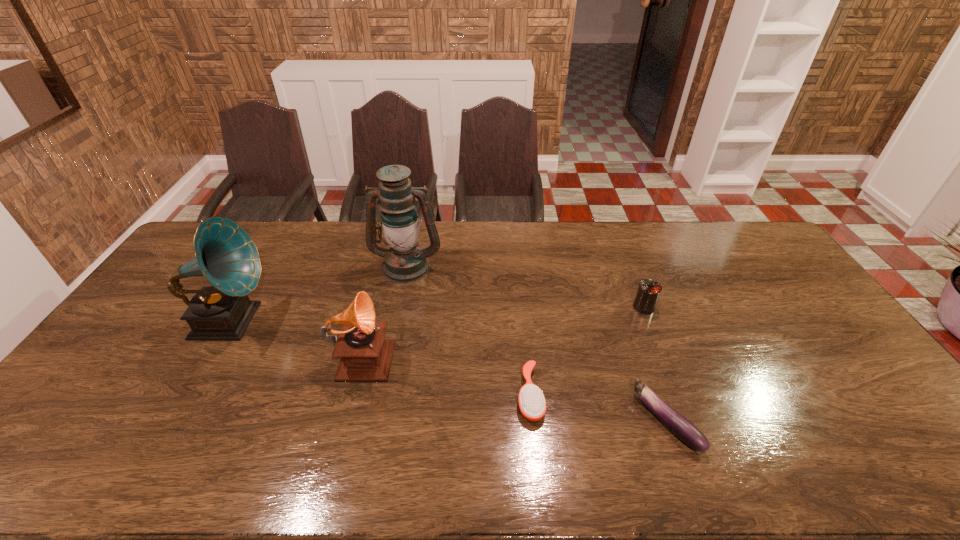
Locate an element on the screen. object that stands as the fifth closest to the farthest object is located at coordinates (681, 427).

I want to click on the second closest object to the oil lamp, so click(x=225, y=254).

The width and height of the screenshot is (960, 540). Identify the location of free space that satisfies the following two spatial constraints: 1. on the horn of the eggplant; 2. on the right side of the third tallest object. (346, 421).

Find the location of `free space that satisfies the following two spatial constraints: 1. on the back side of the hairbrush; 2. on the horn of the right phonograph record`. free space that satisfies the following two spatial constraints: 1. on the back side of the hairbrush; 2. on the horn of the right phonograph record is located at coordinates (526, 353).

You are a GUI agent. You are given a task and a screenshot of the screen. Output one action in this format:
    pyautogui.click(x=<x>, y=<y>)
    Task: Click on the vacant area in the image that satisfies the following two spatial constraints: 1. from the horn of the eggplant; 2. on the left side of the leftmost object
    
    Given the screenshot: What is the action you would take?
    (172, 421)

The height and width of the screenshot is (540, 960). What are the coordinates of `vacant region that satisfies the following two spatial constraints: 1. on the front side of the oil lamp; 2. on the right side of the eggplant` in the screenshot? It's located at (376, 421).

At what (x,y) coordinates should I click in order to perform the action: click on free space that satisfies the following two spatial constraints: 1. on the horn of the right phonograph record; 2. on the left side of the fourth object from left to right. Please return your answer as a coordinate pair (x, y). This screenshot has width=960, height=540. Looking at the image, I should click on (352, 395).

I want to click on free spot that satisfies the following two spatial constraints: 1. on the front side of the oil lamp; 2. on the left side of the eggplant, so click(x=376, y=421).

You are a GUI agent. You are given a task and a screenshot of the screen. Output one action in this format:
    pyautogui.click(x=<x>, y=<y>)
    Task: Click on the free spot that satisfies the following two spatial constraints: 1. from the horn of the left phonograph record; 2. on the left side of the eggplant
    This screenshot has width=960, height=540.
    Given the screenshot: What is the action you would take?
    pyautogui.click(x=172, y=421)

Locate an element on the screen. This screenshot has width=960, height=540. free space that satisfies the following two spatial constraints: 1. on the back side of the eggplant; 2. from the horn of the leftmost object is located at coordinates (631, 321).